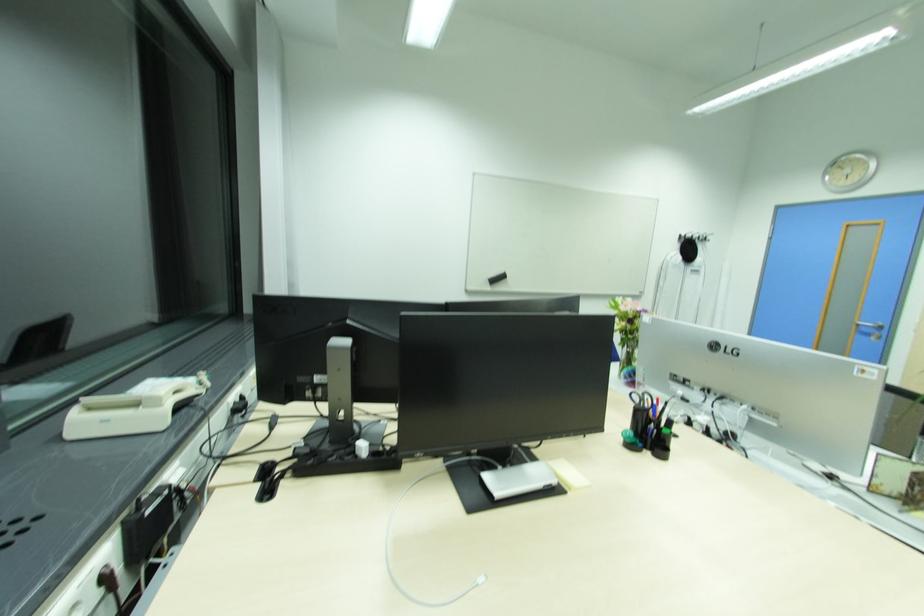
You are a GUI agent. You are given a task and a screenshot of the screen. Output one action in this format:
    pyautogui.click(x=<x>, y=<y>)
    Task: Click on the pair of scissors
    Image resolution: width=924 pixels, height=616 pixels.
    Given the screenshot: What is the action you would take?
    pyautogui.click(x=642, y=415)